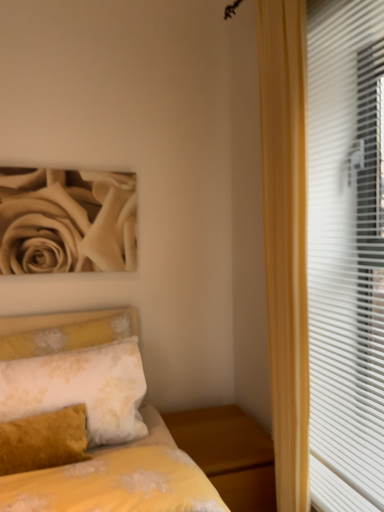
Question: Is white plastic blinds at right not within white floral fabric pillow at lower left?

Choices:
 (A) no
 (B) yes

Answer: (B)

Question: Considering the relative sizes of white plastic blinds at right and white floral fabric pillow at lower left in the image provided, is white plastic blinds at right taller than white floral fabric pillow at lower left?

Choices:
 (A) no
 (B) yes

Answer: (B)

Question: From a real-world perspective, does white plastic blinds at right sit lower than white floral fabric pillow at lower left?

Choices:
 (A) no
 (B) yes

Answer: (A)

Question: Is the position of white plastic blinds at right less distant than that of white floral fabric pillow at lower left?

Choices:
 (A) no
 (B) yes

Answer: (B)

Question: Is white plastic blinds at right to the left of white floral fabric pillow at lower left from the viewer's perspective?

Choices:
 (A) yes
 (B) no

Answer: (B)

Question: From the image's perspective, is white plastic blinds at right under white floral fabric pillow at lower left?

Choices:
 (A) no
 (B) yes

Answer: (A)

Question: Is white floral fabric pillow at lower left smaller than beige matte rose at upper left?

Choices:
 (A) no
 (B) yes

Answer: (A)

Question: Is white floral fabric pillow at lower left closer to camera compared to beige matte rose at upper left?

Choices:
 (A) no
 (B) yes

Answer: (B)

Question: Can you confirm if white floral fabric pillow at lower left is taller than beige matte rose at upper left?

Choices:
 (A) yes
 (B) no

Answer: (B)

Question: Is white floral fabric pillow at lower left further to the viewer compared to beige matte rose at upper left?

Choices:
 (A) no
 (B) yes

Answer: (A)

Question: Is white floral fabric pillow at lower left completely or partially outside of beige matte rose at upper left?

Choices:
 (A) yes
 (B) no

Answer: (A)

Question: From the image's perspective, is white floral fabric pillow at lower left above beige matte rose at upper left?

Choices:
 (A) no
 (B) yes

Answer: (A)

Question: Can you confirm if white floral fabric pillow at lower left is taller than yellow floral fabric bed at lower left?

Choices:
 (A) no
 (B) yes

Answer: (A)